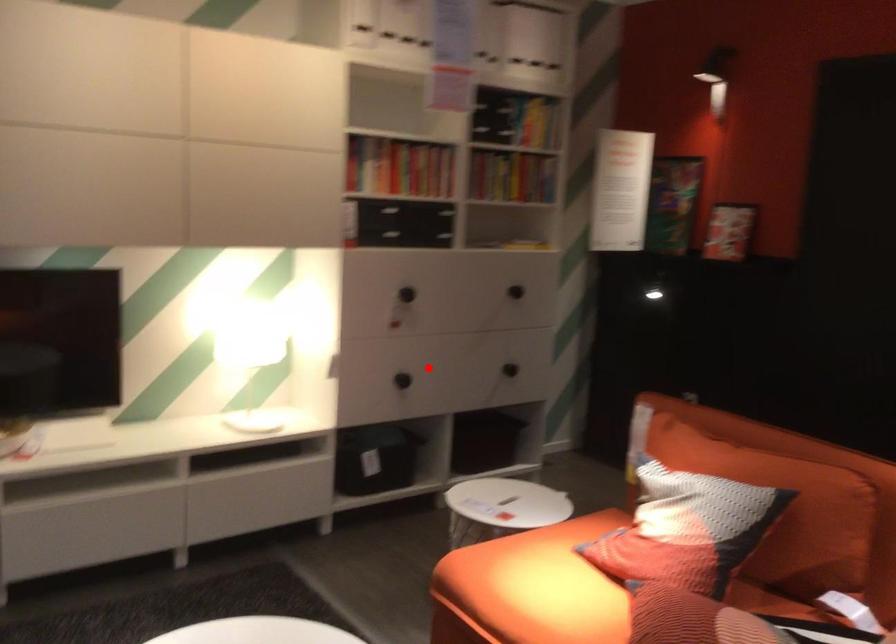
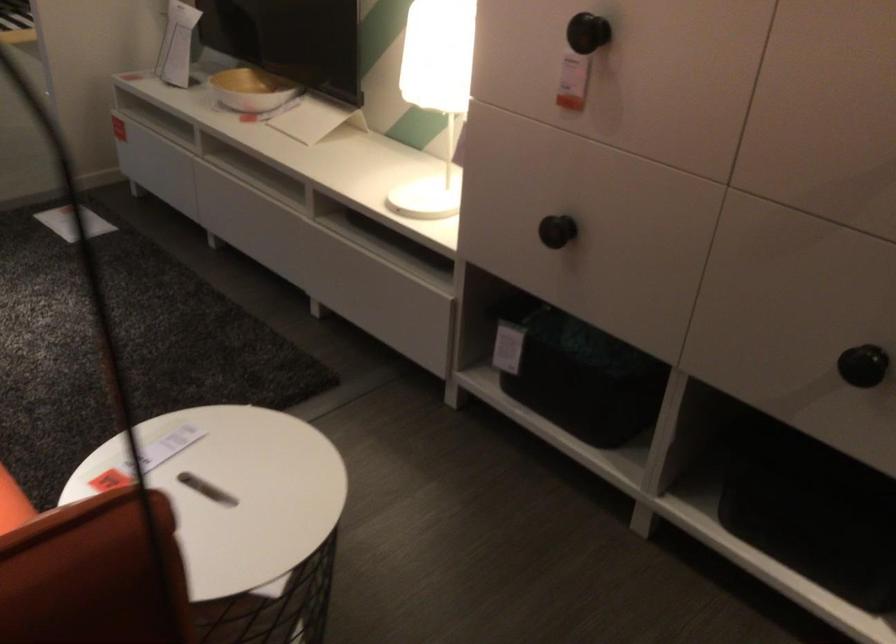
Question: I am providing you with two images of the same scene from different viewpoints. A red point is shown in image1. For the corresponding object point in image2, is it positioned nearer or farther from the camera?

Choices:
 (A) Nearer
 (B) Farther

Answer: (A)